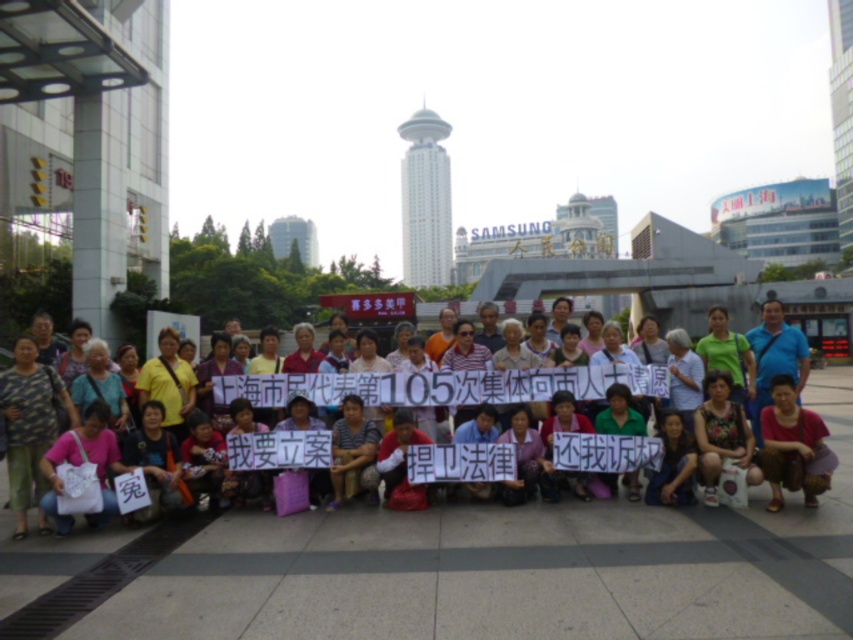
Question: Is matte pink shirt at center below matte pink blouse at center?

Choices:
 (A) yes
 (B) no

Answer: (A)

Question: Among these objects, which one is nearest to the camera?

Choices:
 (A) matte pink blouse at center
 (B) matte pink shirt at center

Answer: (A)

Question: Which object is closer to the camera taking this photo?

Choices:
 (A) matte pink blouse at center
 (B) matte pink shirt at center

Answer: (A)

Question: Is matte pink shirt at center smaller than matte pink blouse at center?

Choices:
 (A) no
 (B) yes

Answer: (A)

Question: Is the position of matte pink shirt at center less distant than that of matte pink blouse at center?

Choices:
 (A) yes
 (B) no

Answer: (B)

Question: Which point appears farthest from the camera in this image?

Choices:
 (A) (814, 465)
 (B) (494, 396)

Answer: (B)